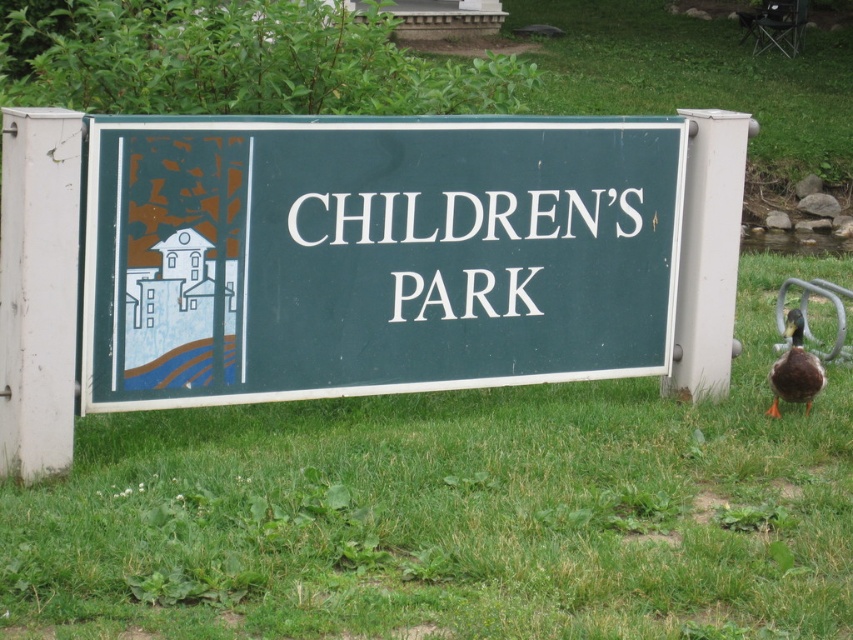
Question: Does green matte sign at center appear under brown matte duck at lower right?

Choices:
 (A) no
 (B) yes

Answer: (A)

Question: Considering the real-world distances, which object is farthest from the green grass at center?

Choices:
 (A) green matte sign at center
 (B) brown matte duck at lower right

Answer: (B)

Question: Is green grass at center to the left of brown matte duck at lower right from the viewer's perspective?

Choices:
 (A) yes
 (B) no

Answer: (A)

Question: Is green grass at center wider than brown matte duck at lower right?

Choices:
 (A) yes
 (B) no

Answer: (A)

Question: Estimate the real-world distances between objects in this image. Which object is farther from the green matte sign at center?

Choices:
 (A) green grass at center
 (B) brown matte duck at lower right

Answer: (B)

Question: Which point appears closest to the camera in this image?

Choices:
 (A) (392, 440)
 (B) (422, 349)
 (C) (784, 364)

Answer: (A)